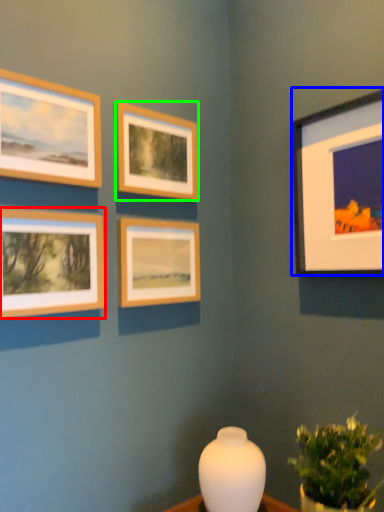
Question: Which is farther away from picture frame (highlighted by a red box)? picture frame (highlighted by a blue box) or picture frame (highlighted by a green box)?

Choices:
 (A) picture frame
 (B) picture frame

Answer: (A)